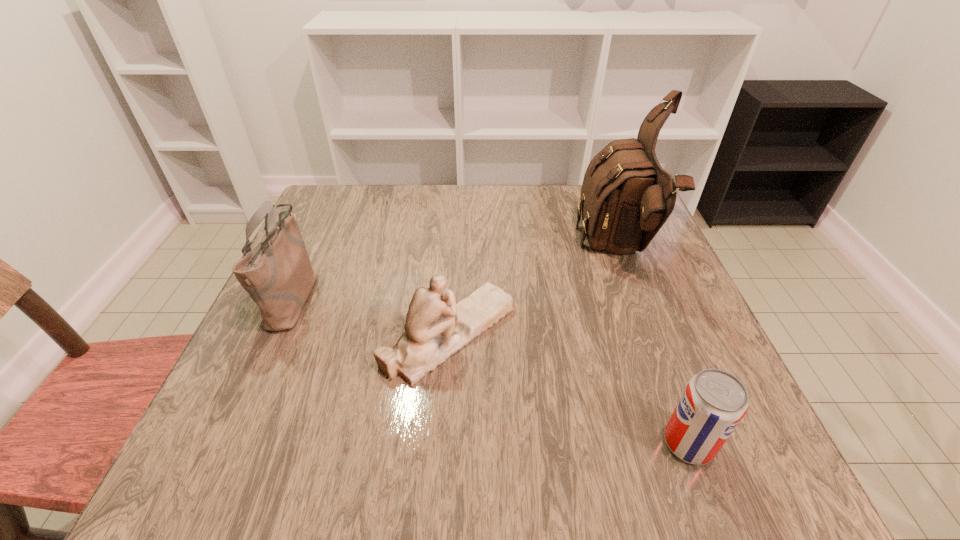
This screenshot has width=960, height=540. Find the location of `free space that satisfies the following two spatial constraints: 1. on the front-facing side of the figurine; 2. on the right side of the nearest object`. free space that satisfies the following two spatial constraints: 1. on the front-facing side of the figurine; 2. on the right side of the nearest object is located at coordinates (443, 443).